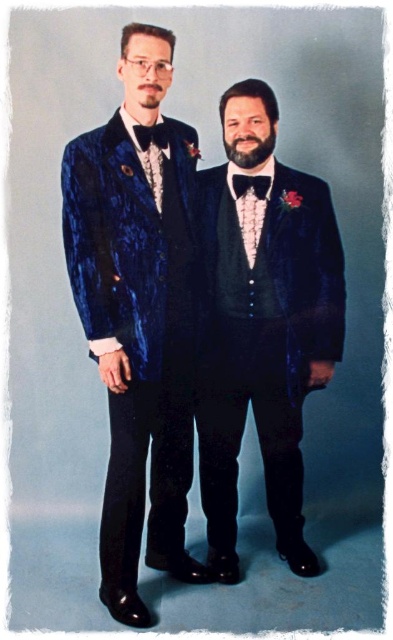
Both men are wearing bow ties. The man on the left has a black velvet bow tie at center and the man on the right has a black satin bow tie at center. Which bow tie is shorter?

The black velvet bow tie at center is shorter than the black satin bow tie at center.

You are a photographer trying to capture a closeup of the boutonniere on the man on the left. You are currently standing at point (137, 316). Can you reach the boutonniere from your current position?

The point (137, 316) is on the velvet blue tuxedo at left, so yes, you can reach the boutonniere on the man on the left from that position.

You are a photographer trying to position two subjects for a formal portrait. The scene has a velvet blue tuxedo at center. Where should you place the second subject to ensure symmetry in the composition?

To achieve symmetry, the second subject should be placed equidistant from the center but on the opposite side of the velvet blue tuxedo at center. Since the velvet blue tuxedo at center is at point (264, 324), the second subject should be positioned at a mirrored coordinate relative to the center point.